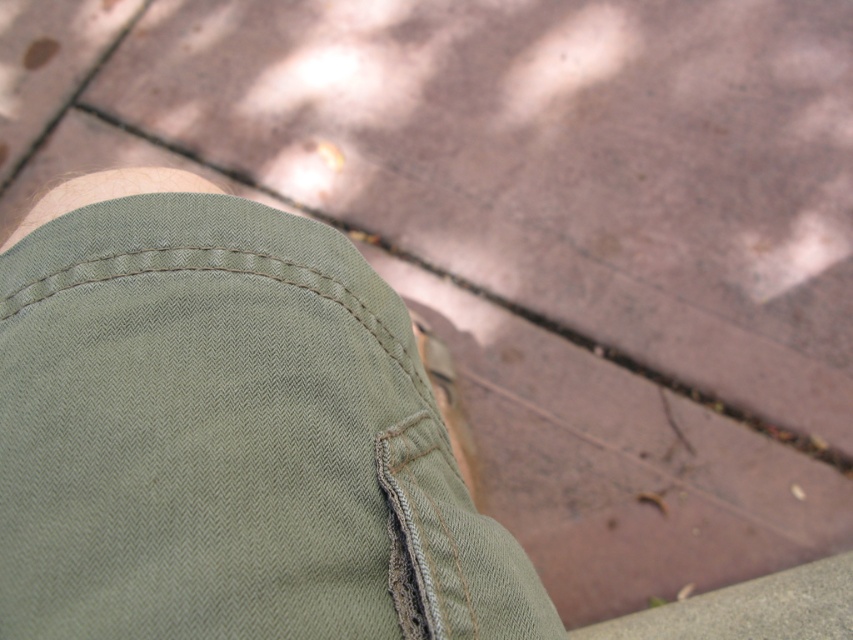
Question: Which point appears farthest from the camera in this image?

Choices:
 (A) (239, 268)
 (B) (450, 385)

Answer: (B)

Question: Observing the image, what is the correct spatial positioning of olive-green denim shorts at center in reference to light brown suede shoe at lower center?

Choices:
 (A) right
 (B) left

Answer: (B)

Question: Does olive-green denim shorts at center have a larger size compared to light brown suede shoe at lower center?

Choices:
 (A) yes
 (B) no

Answer: (A)

Question: Is olive-green denim shorts at center below light brown suede shoe at lower center?

Choices:
 (A) yes
 (B) no

Answer: (B)